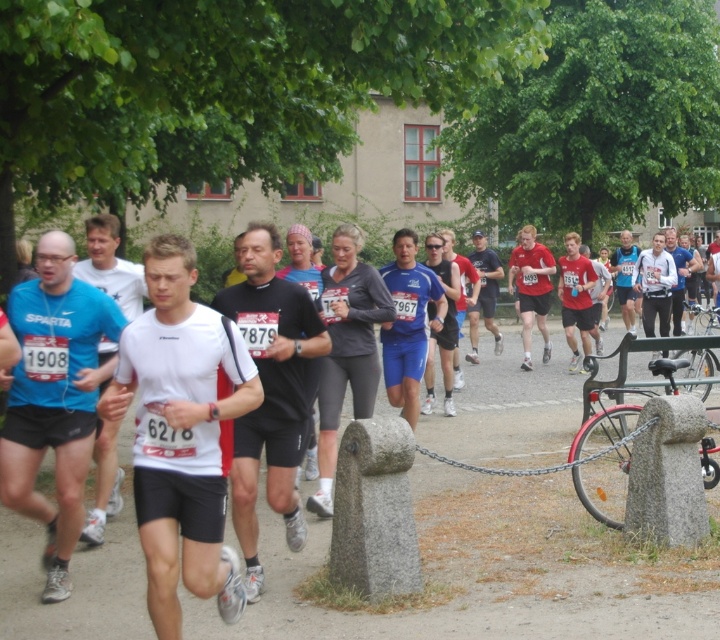
Consider the image. You are a photographer standing in the middle of the marathon route. You want to take a photo that includes both the point at coordinates point (287, 408) and point (649, 340). Which point should you focus on first to ensure both are in the frame?

You should focus on point (287, 408) first because it is closer to you than point (649, 340), ensuring both points are within the camera frame.